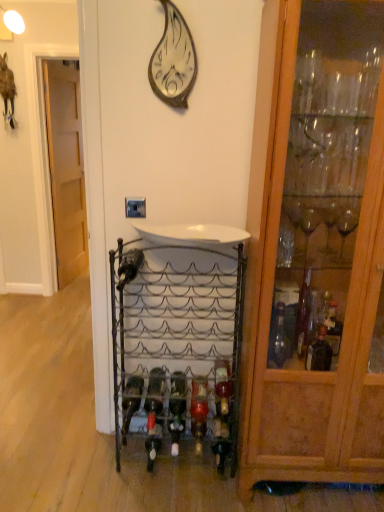
Question: Would you say metallic wine rack at center is outside light brown wood door at left?

Choices:
 (A) yes
 (B) no

Answer: (A)

Question: Is metallic wine rack at center far away from light brown wood door at left?

Choices:
 (A) yes
 (B) no

Answer: (A)

Question: From a real-world perspective, does metallic wine rack at center sit lower than light brown wood door at left?

Choices:
 (A) no
 (B) yes

Answer: (B)

Question: Does metallic wine rack at center touch light brown wood door at left?

Choices:
 (A) yes
 (B) no

Answer: (B)

Question: From a real-world perspective, is metallic wine rack at center positioned over light brown wood door at left based on gravity?

Choices:
 (A) no
 (B) yes

Answer: (A)

Question: Would you say white glossy sink at center is inside or outside metallic wine rack at center?

Choices:
 (A) outside
 (B) inside

Answer: (A)

Question: In terms of width, does white glossy sink at center look wider or thinner when compared to metallic wine rack at center?

Choices:
 (A) wide
 (B) thin

Answer: (A)

Question: Relative to metallic wine rack at center, is white glossy sink at center in front or behind?

Choices:
 (A) behind
 (B) front

Answer: (B)

Question: Is point (203, 226) positioned closer to the camera than point (213, 346)?

Choices:
 (A) farther
 (B) closer

Answer: (B)

Question: Is point (188, 295) closer or farther from the camera than point (158, 56)?

Choices:
 (A) farther
 (B) closer

Answer: (A)

Question: In terms of size, does metallic wine rack at center appear bigger or smaller than metallic silver wall clock at upper center?

Choices:
 (A) big
 (B) small

Answer: (A)

Question: From a real-world perspective, is metallic wine rack at center physically located above or below metallic silver wall clock at upper center?

Choices:
 (A) below
 (B) above

Answer: (A)

Question: Considering the relative positions of metallic wine rack at center and metallic silver wall clock at upper center in the image provided, is metallic wine rack at center to the left or to the right of metallic silver wall clock at upper center?

Choices:
 (A) right
 (B) left

Answer: (A)

Question: Is white glossy sink at center taller or shorter than wooden cabinet at right?

Choices:
 (A) short
 (B) tall

Answer: (A)

Question: From a real-world perspective, is white glossy sink at center above or below wooden cabinet at right?

Choices:
 (A) below
 (B) above

Answer: (B)